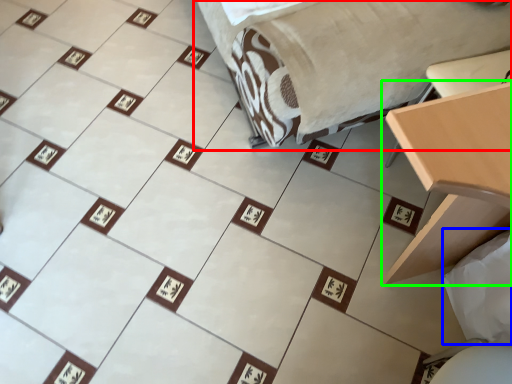
Question: Considering the real-world distances, which object is farthest from furniture (highlighted by a red box)? sheet (highlighted by a blue box) or table (highlighted by a green box)?

Choices:
 (A) sheet
 (B) table

Answer: (A)